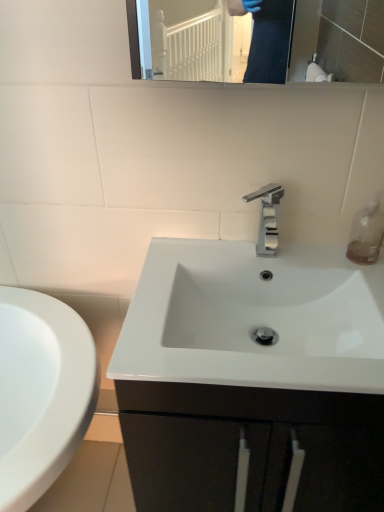
Question: Considering their positions, is transparent plastic soap dispenser at upper right located in front of or behind polished chrome faucet at center?

Choices:
 (A) behind
 (B) front

Answer: (A)

Question: Considering the positions of transparent plastic soap dispenser at upper right and polished chrome faucet at center in the image, is transparent plastic soap dispenser at upper right wider or thinner than polished chrome faucet at center?

Choices:
 (A) wide
 (B) thin

Answer: (B)

Question: From a real-world perspective, is transparent plastic soap dispenser at upper right physically located above or below polished chrome faucet at center?

Choices:
 (A) below
 (B) above

Answer: (A)

Question: From a real-world perspective, is polished chrome faucet at center physically located above or below transparent plastic soap dispenser at upper right?

Choices:
 (A) below
 (B) above

Answer: (B)

Question: Looking at their shapes, would you say polished chrome faucet at center is wider or thinner than transparent plastic soap dispenser at upper right?

Choices:
 (A) wide
 (B) thin

Answer: (A)

Question: Does point (274, 197) appear closer or farther from the camera than point (364, 221)?

Choices:
 (A) closer
 (B) farther

Answer: (A)

Question: Do you think polished chrome faucet at center is within transparent plastic soap dispenser at upper right, or outside of it?

Choices:
 (A) outside
 (B) inside

Answer: (A)